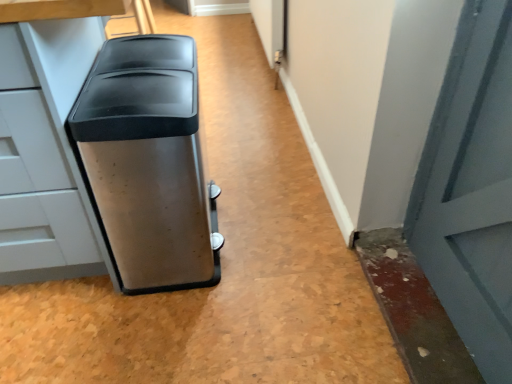
What are the coordinates of `unoccupied region to the right of satin metallic trash can at left` in the screenshot? It's located at (267, 241).